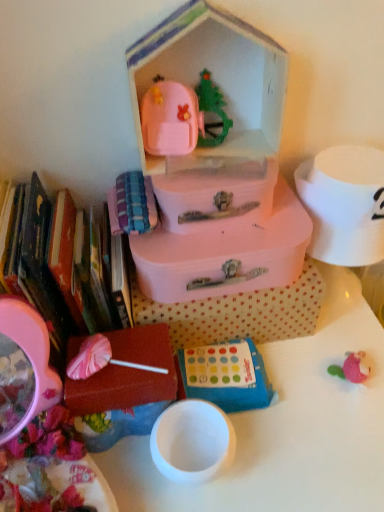
Locate an element on the screen. The height and width of the screenshot is (512, 384). free space above matte pink suitcase at center, arranged as the second storage box when viewed from the top (from a real-world perspective) is located at coordinates (220, 226).